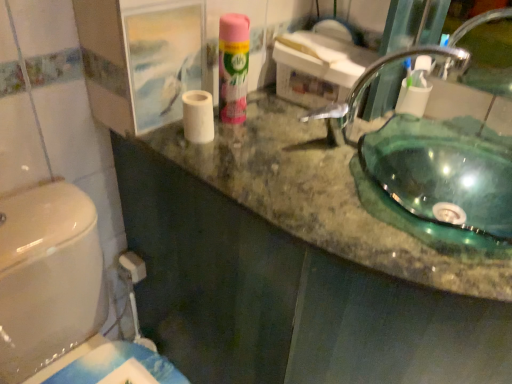
You are a GUI agent. You are given a task and a screenshot of the screen. Output one action in this format:
    pyautogui.click(x=<x>, y=<y>)
    Task: Click on the vacant area that lies between transparent glass sink at upper right and pink matte air freshener at upper center
    
    Given the screenshot: What is the action you would take?
    pyautogui.click(x=283, y=134)